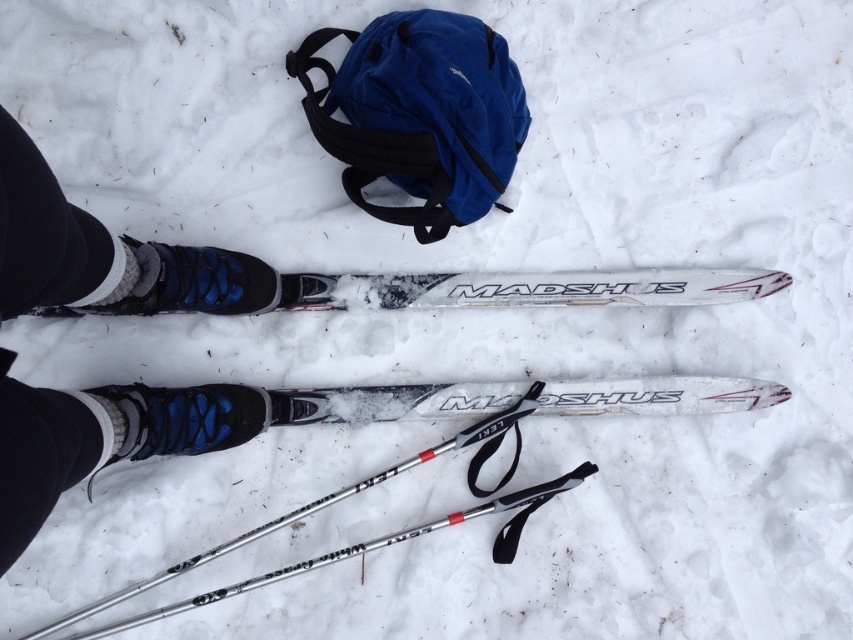
Does point (53, 300) come in front of point (466, 385)?

That is True.

What do you see at coordinates (103, 253) in the screenshot? I see `blue synthetic ski boot at lower left` at bounding box center [103, 253].

I want to click on blue synthetic ski boot at lower left, so click(x=103, y=253).

Can you confirm if white matte ski at lower center is smaller than silver metallic ski pole at lower center?

Indeed, white matte ski at lower center has a smaller size compared to silver metallic ski pole at lower center.

Consider the image. Is white matte ski at lower center above silver metallic ski pole at lower center?

Yes.

Who is more forward, (476,289) or (332,497)?

Point (332,497)

At what (x,y) coordinates should I click in order to perform the action: click on white matte ski at lower center. Please return your answer as a coordinate pair (x, y). This screenshot has height=640, width=853. Looking at the image, I should click on 527,289.

Does white matte ski at lower center have a greater width compared to white matte madshus ski at center?

Incorrect, white matte ski at lower center's width does not surpass white matte madshus ski at center's.

This screenshot has width=853, height=640. I want to click on white matte ski at lower center, so click(x=527, y=289).